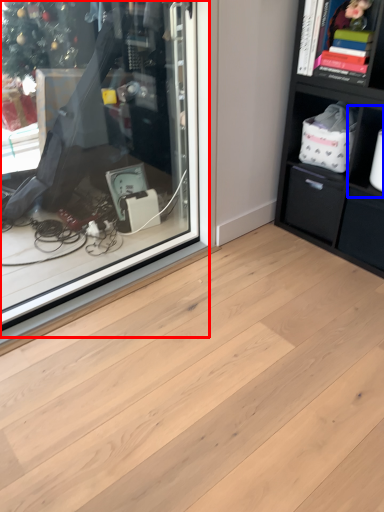
Question: Which of the following is the farthest to the observer, shop window (highlighted by a red box) or cabinet (highlighted by a blue box)?

Choices:
 (A) shop window
 (B) cabinet

Answer: (B)